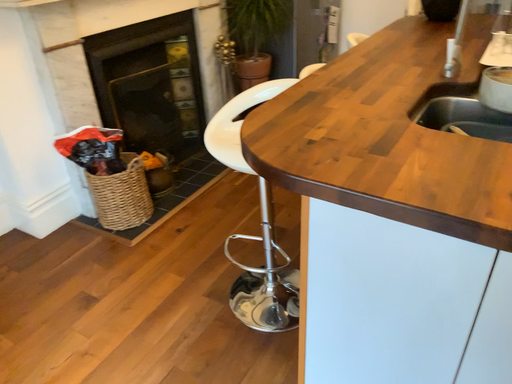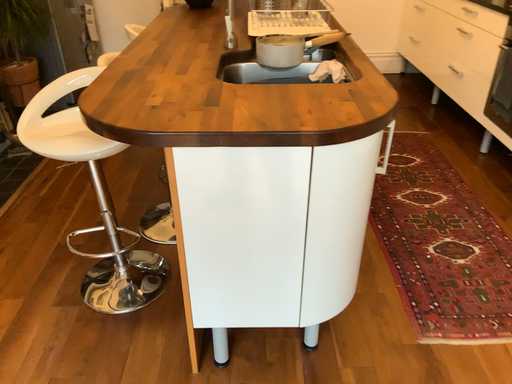
Question: Which way did the camera rotate in the video?

Choices:
 (A) rotated left
 (B) rotated right

Answer: (B)